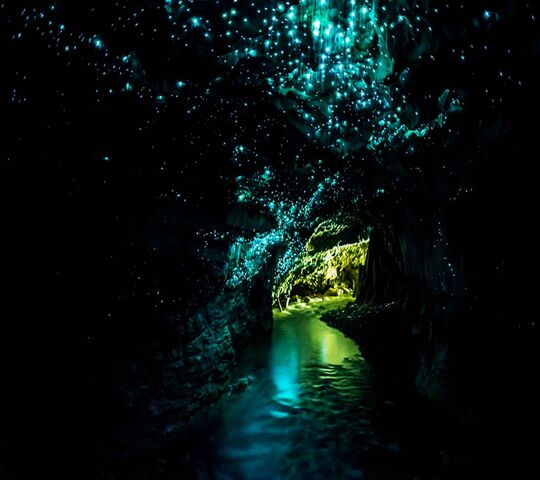
Locate an element on the screen. Image resolution: width=540 pixels, height=480 pixels. ledge is located at coordinates (352, 314).